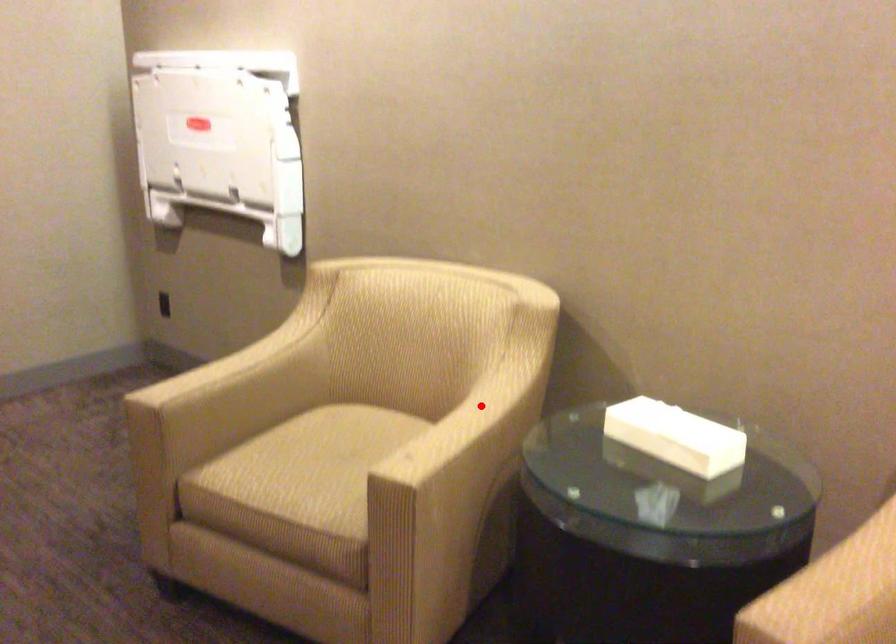
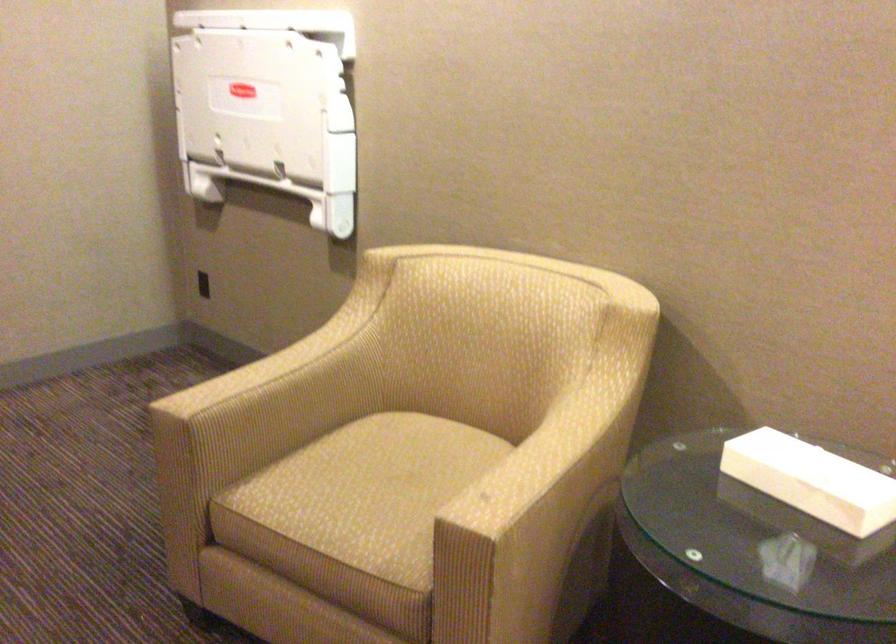
Find the pixel in the second image that matches the highlighted location in the first image.

(565, 426)